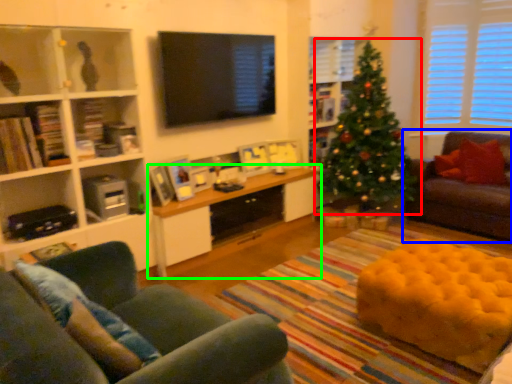
Question: Based on their relative distances, which object is farther from christmas tree (highlighted by a red box)? Choose from studio couch (highlighted by a blue box) and table (highlighted by a green box).

Choices:
 (A) studio couch
 (B) table

Answer: (B)